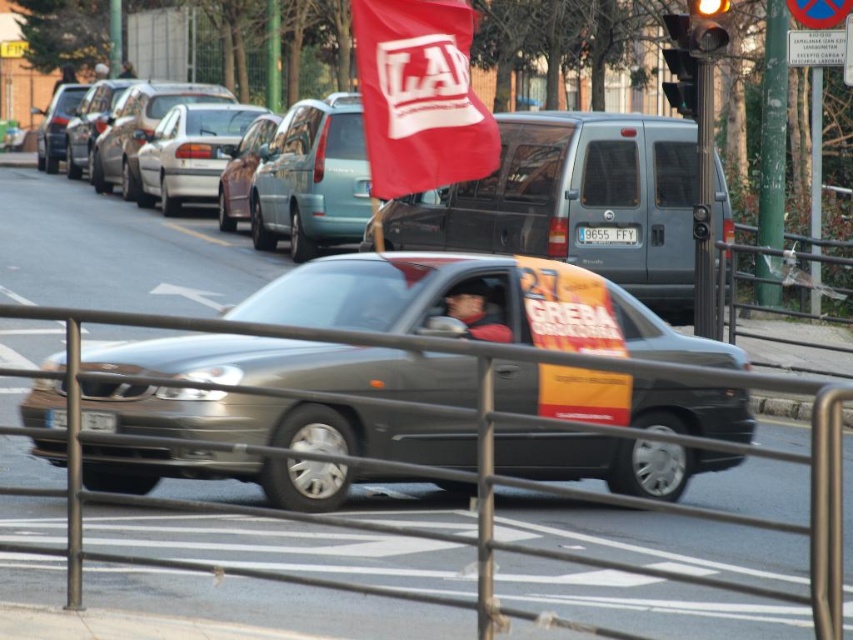
Does metallic gray car at center come behind metallic silver sedan at center?

No, metallic gray car at center is closer to the viewer.

Is metallic gray car at center in front of metallic silver sedan at center?

Yes, metallic gray car at center is closer to the viewer.

Between point (265, 369) and point (312, 172), which one is positioned behind?

Positioned behind is point (312, 172).

Where is `metallic gray car at center`? metallic gray car at center is located at coordinates (285, 422).

Which of these two, metallic gray car at center or matte gray van at center, stands taller?

Standing taller between the two is matte gray van at center.

Between point (604, 467) and point (608, 152), which one is positioned behind?

Point (608, 152)

Is point (634, 397) positioned before point (585, 129)?

Yes.

The image size is (853, 640). Find the location of `metallic gray car at center`. metallic gray car at center is located at coordinates (285, 422).

The height and width of the screenshot is (640, 853). Describe the element at coordinates (527, 419) in the screenshot. I see `metallic gray rail at center` at that location.

Can you confirm if metallic gray rail at center is bigger than metallic yellow traffic light at upper center?

Yes.

Does point (369, 342) come farther from viewer compared to point (706, 49)?

No, it is in front of (706, 49).

Identify the location of metallic gray rail at center. (527, 419).